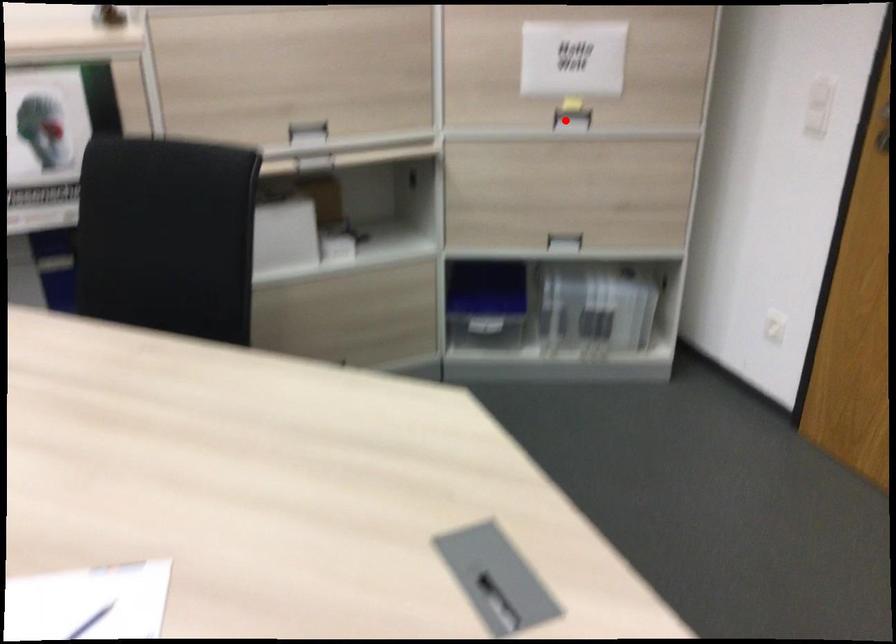
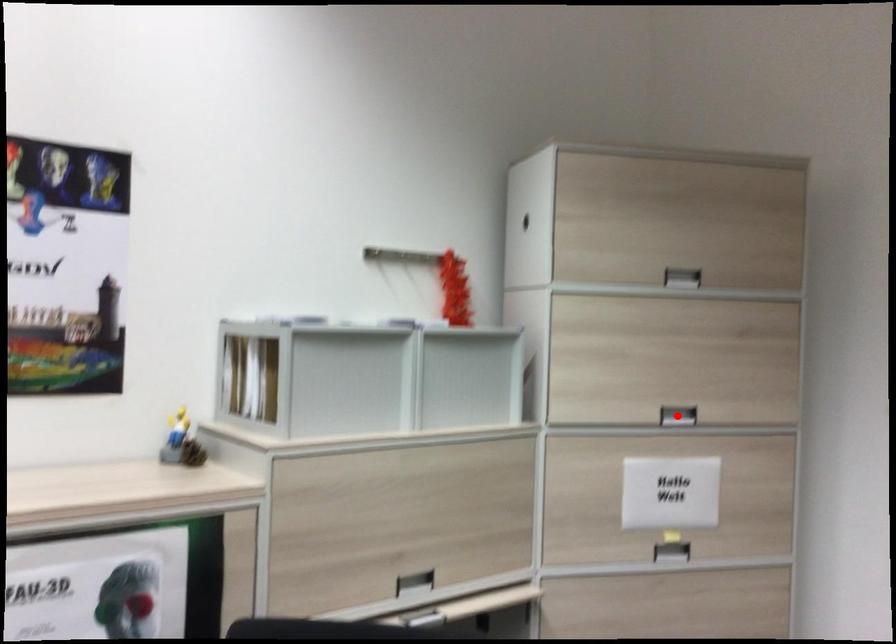
I am providing you with two images of the same scene from different viewpoints. A red point is marked on the first image and another point is marked on the second image. Does the point marked in image1 correspond to the same location as the one in image2?

No